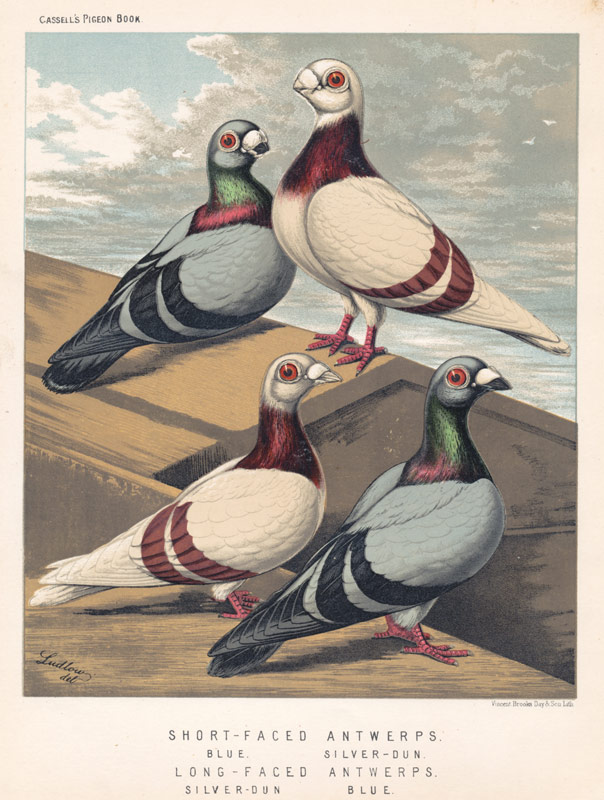
Find the location of a particular element. The image size is (604, 800). wood beam is located at coordinates (56, 300).